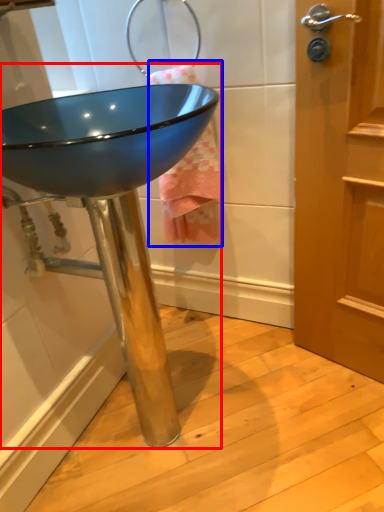
Question: Which object appears farthest to the camera in this image, sink (highlighted by a red box) or bath towel (highlighted by a blue box)?

Choices:
 (A) sink
 (B) bath towel

Answer: (B)